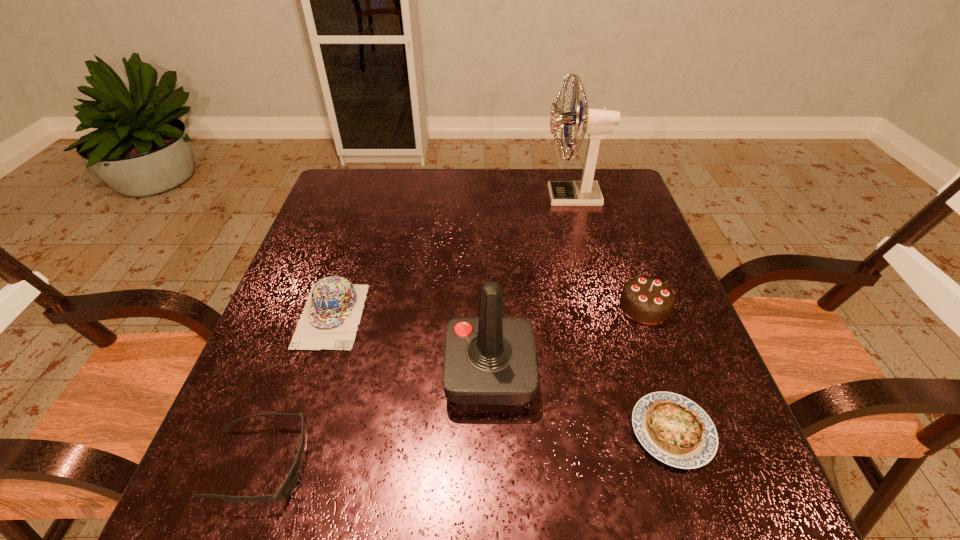
Locate an element on the screen. Image resolution: width=960 pixels, height=540 pixels. free spot between the farthest object and the quiche is located at coordinates (622, 314).

Where is `empty space that is in between the fifth tallest object and the quiche`? The image size is (960, 540). empty space that is in between the fifth tallest object and the quiche is located at coordinates (466, 447).

This screenshot has height=540, width=960. I want to click on unoccupied position between the fourth tallest object and the second shortest object, so click(x=296, y=389).

Find the location of a particular element. The height and width of the screenshot is (540, 960). object that is the fifth closest to the fifth tallest object is located at coordinates (597, 123).

Locate an element on the screen. object that is the fifth closest to the farthest object is located at coordinates (287, 487).

In order to click on free space that satisfies the following two spatial constraints: 1. on the front, side, and top of the third shortest object; 2. on the right side of the fifth shortest object in this screenshot , I will do `click(313, 373)`.

Image resolution: width=960 pixels, height=540 pixels. In order to click on vacant region that satisfies the following two spatial constraints: 1. on the front-facing side of the fan; 2. on the left side of the shortest object in this screenshot , I will do click(636, 431).

Find the location of a particular element. The image size is (960, 540). vacant space that satisfies the following two spatial constraints: 1. on the front, side, and top of the third object from left to right; 2. on the left side of the cap is located at coordinates (313, 373).

The height and width of the screenshot is (540, 960). In order to click on free spot that satisfies the following two spatial constraints: 1. on the front, side, and top of the fourth tallest object; 2. on the front-facing side of the sunglasses in this screenshot , I will do `click(284, 463)`.

Identify the location of vacant point that satisfies the following two spatial constraints: 1. on the front, side, and top of the joystick; 2. on the right side of the fourth tallest object. This screenshot has height=540, width=960. pos(313,373).